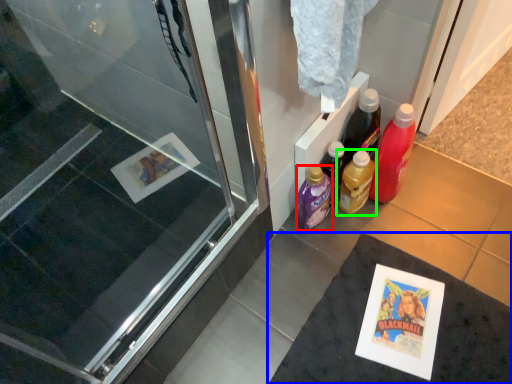
Question: Considering the real-world distances, which object is farthest from bottle (highlighted by a red box)? bath mat (highlighted by a blue box) or bottle (highlighted by a green box)?

Choices:
 (A) bath mat
 (B) bottle

Answer: (A)